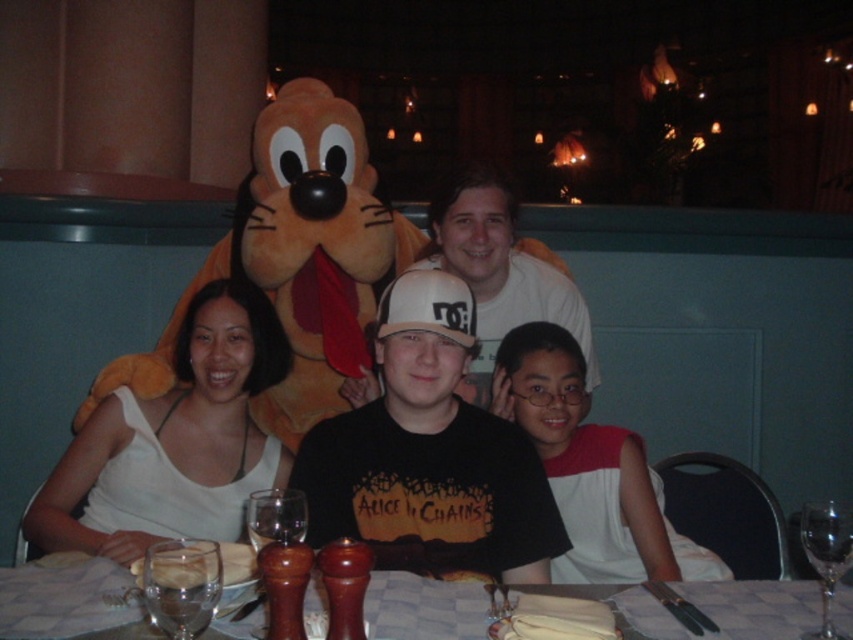
You are a photographer trying to capture a clear shot of the wooden table at center and the white matte shirt at center. Since you can only focus on one object at a time, which one should you focus on to ensure it appears sharp in the photo?

The wooden table at center is closer to the viewer than the white matte shirt at center, so focusing on the wooden table at center will ensure it appears sharp. If you focus on the white matte shirt at center, the wooden table at center may appear blurry due to the depth of field limitations.